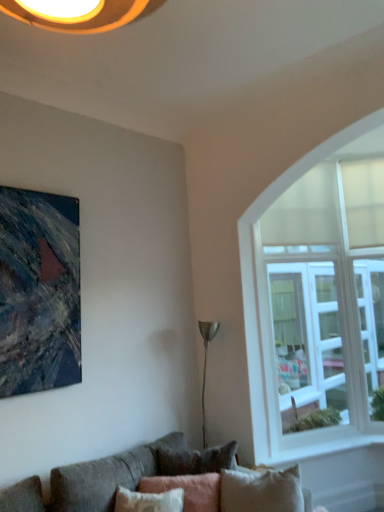
Question: From a real-world perspective, is textured gray couch at lower left physically below white glass window at right?

Choices:
 (A) yes
 (B) no

Answer: (A)

Question: Can you confirm if textured gray couch at lower left is wider than white glass window at right?

Choices:
 (A) yes
 (B) no

Answer: (A)

Question: Is textured gray couch at lower left surrounding white glass window at right?

Choices:
 (A) yes
 (B) no

Answer: (B)

Question: Is textured gray couch at lower left smaller than white glass window at right?

Choices:
 (A) yes
 (B) no

Answer: (B)

Question: Is textured gray couch at lower left closer to camera compared to white glass window at right?

Choices:
 (A) no
 (B) yes

Answer: (B)

Question: Is textured gray couch at lower left positioned with its back to white glass window at right?

Choices:
 (A) no
 (B) yes

Answer: (A)

Question: Does pink fabric pillow at lower center have a larger size compared to textured canvas painting at upper left?

Choices:
 (A) no
 (B) yes

Answer: (B)

Question: Considering the relative positions of pink fabric pillow at lower center and textured canvas painting at upper left in the image provided, is pink fabric pillow at lower center to the right of textured canvas painting at upper left from the viewer's perspective?

Choices:
 (A) yes
 (B) no

Answer: (A)

Question: Considering the relative sizes of pink fabric pillow at lower center and textured canvas painting at upper left in the image provided, is pink fabric pillow at lower center taller than textured canvas painting at upper left?

Choices:
 (A) yes
 (B) no

Answer: (B)

Question: Is pink fabric pillow at lower center shorter than textured canvas painting at upper left?

Choices:
 (A) no
 (B) yes

Answer: (B)

Question: From the image's perspective, is pink fabric pillow at lower center below textured canvas painting at upper left?

Choices:
 (A) yes
 (B) no

Answer: (A)

Question: Considering the relative sizes of pink fabric pillow at lower center and textured canvas painting at upper left in the image provided, is pink fabric pillow at lower center smaller than textured canvas painting at upper left?

Choices:
 (A) yes
 (B) no

Answer: (B)

Question: Is white glass window at right to the left of textured gray couch at lower left from the viewer's perspective?

Choices:
 (A) yes
 (B) no

Answer: (B)